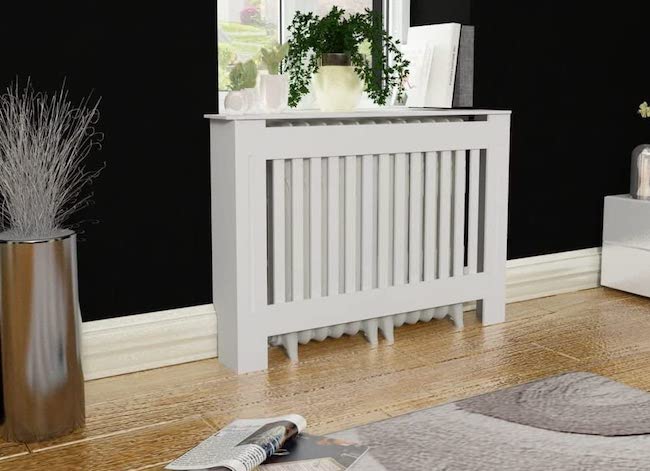
At what (x,y) coordinates should I click in order to perform the action: click on reading material. Please return your answer as a coordinate pair (x, y). Looking at the image, I should click on (467, 57), (446, 73), (421, 70), (312, 440).